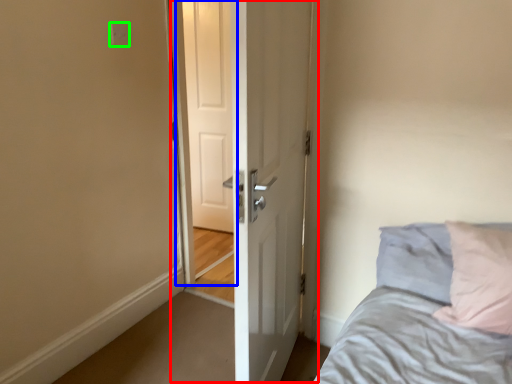
Question: Based on their relative distances, which object is nearer to door (highlighted by a red box)? Choose from screen door (highlighted by a blue box) and electric outlet (highlighted by a green box).

Choices:
 (A) screen door
 (B) electric outlet

Answer: (B)